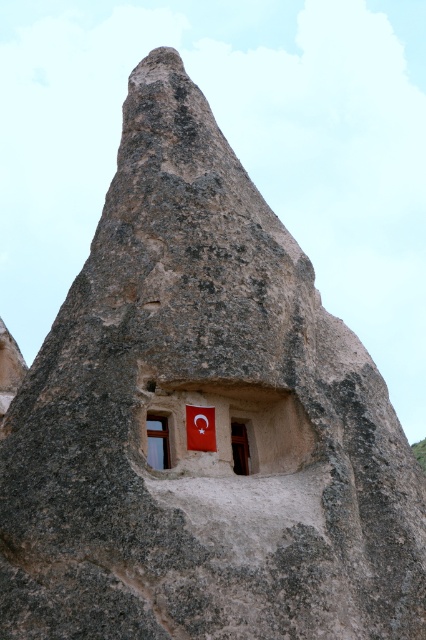
Is matte wood window at center closer to camera compared to matte red flag at center?

Yes, matte wood window at center is closer to the viewer.

Consider the image. Can you confirm if matte wood window at center is bigger than matte red flag at center?

No, matte wood window at center is not bigger than matte red flag at center.

Identify the location of matte wood window at center. (158, 442).

Is the position of red fabric flag at center more distant than that of matte wood window at center?

Yes.

Does red fabric flag at center have a greater height compared to matte wood window at center?

In fact, red fabric flag at center may be shorter than matte wood window at center.

Between point (190, 419) and point (155, 438), which one is positioned in front?

Positioned in front is point (155, 438).

Locate an element on the screen. The image size is (426, 640). red fabric flag at center is located at coordinates (201, 428).

Is red fabric flag at center to the right of matte red flag at center from the viewer's perspective?

In fact, red fabric flag at center is to the left of matte red flag at center.

Is red fabric flag at center shorter than matte red flag at center?

Yes, red fabric flag at center is shorter than matte red flag at center.

Which is behind, point (201, 410) or point (236, 461)?

Point (236, 461)

Locate an element on the screen. The height and width of the screenshot is (640, 426). red fabric flag at center is located at coordinates (201, 428).